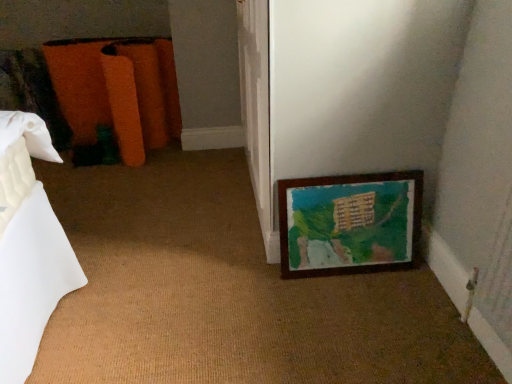
Locate an element on the screen. The height and width of the screenshot is (384, 512). wooden picture frame at lower right is located at coordinates (351, 222).

The height and width of the screenshot is (384, 512). What do you see at coordinates (351, 222) in the screenshot? I see `wooden picture frame at lower right` at bounding box center [351, 222].

This screenshot has width=512, height=384. Find the location of `wooden picture frame at lower right`. wooden picture frame at lower right is located at coordinates (351, 222).